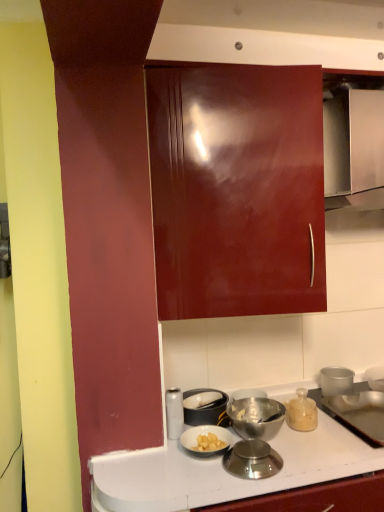
Question: Which direction should I rotate to look at metallic silver scale at lower center, which is the 3th kitchen appliance from back to front, — up or down?

Choices:
 (A) down
 (B) up

Answer: (A)

Question: Can we say matte glass jar at lower right, the 1th kitchen appliance when ordered from right to left, lies outside metallic silver drawer at upper right?

Choices:
 (A) yes
 (B) no

Answer: (A)

Question: Is matte glass jar at lower right, placed as the third kitchen appliance when sorted from front to back, shorter than metallic silver drawer at upper right?

Choices:
 (A) yes
 (B) no

Answer: (A)

Question: Is matte glass jar at lower right, placed as the third kitchen appliance when sorted from front to back, positioned with its back to metallic silver drawer at upper right?

Choices:
 (A) no
 (B) yes

Answer: (A)

Question: From the image's perspective, is matte glass jar at lower right, placed as the third kitchen appliance when sorted from front to back, on metallic silver drawer at upper right?

Choices:
 (A) yes
 (B) no

Answer: (B)

Question: Considering the relative sizes of matte glass jar at lower right, the 1th kitchen appliance when ordered from right to left, and metallic silver drawer at upper right in the image provided, is matte glass jar at lower right, the 1th kitchen appliance when ordered from right to left, smaller than metallic silver drawer at upper right?

Choices:
 (A) no
 (B) yes

Answer: (B)

Question: Is matte glass jar at lower right, placed as the 1th kitchen appliance when sorted from back to front, directly adjacent to metallic silver drawer at upper right?

Choices:
 (A) no
 (B) yes

Answer: (A)

Question: From the image's perspective, does metallic silver scale at lower center, the 1th kitchen appliance positioned from the front, appear higher than white glossy canister at lower center, which is the 2th kitchen appliance in back-to-front order?

Choices:
 (A) no
 (B) yes

Answer: (A)

Question: Does metallic silver scale at lower center, the 1th kitchen appliance positioned from the front, appear on the right side of white glossy canister at lower center, which is the 2th kitchen appliance in back-to-front order?

Choices:
 (A) yes
 (B) no

Answer: (A)

Question: Considering the relative sizes of metallic silver scale at lower center, the 1th kitchen appliance positioned from the front, and white glossy canister at lower center, the 3th kitchen appliance in the right-to-left sequence, in the image provided, is metallic silver scale at lower center, the 1th kitchen appliance positioned from the front, wider than white glossy canister at lower center, the 3th kitchen appliance in the right-to-left sequence,?

Choices:
 (A) no
 (B) yes

Answer: (B)

Question: Is metallic silver scale at lower center, the second kitchen appliance positioned from the left, at the left side of white glossy canister at lower center, the 3th kitchen appliance in the right-to-left sequence?

Choices:
 (A) yes
 (B) no

Answer: (B)

Question: Would you say metallic silver scale at lower center, placed as the second kitchen appliance when sorted from right to left, contains white glossy canister at lower center, the second kitchen appliance positioned from the front?

Choices:
 (A) yes
 (B) no

Answer: (B)

Question: Does metallic silver scale at lower center, placed as the second kitchen appliance when sorted from right to left, have a lesser height compared to white glossy canister at lower center, the 3th kitchen appliance in the right-to-left sequence?

Choices:
 (A) no
 (B) yes

Answer: (B)

Question: Is metallic silver scale at lower center, which is the 3th kitchen appliance from back to front, turned away from matte glass jar at lower right, which ranks as the 3th kitchen appliance in left-to-right order?

Choices:
 (A) yes
 (B) no

Answer: (B)